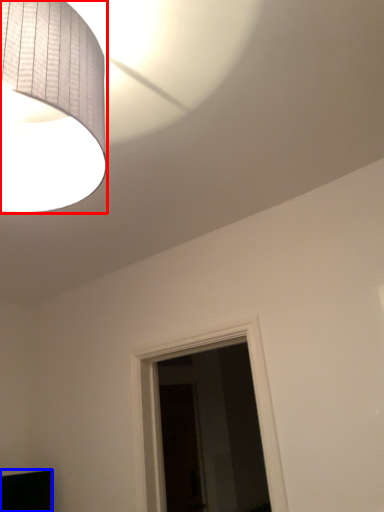
Question: Which object is closer to the camera taking this photo, lamp (highlighted by a red box) or furniture (highlighted by a blue box)?

Choices:
 (A) lamp
 (B) furniture

Answer: (A)